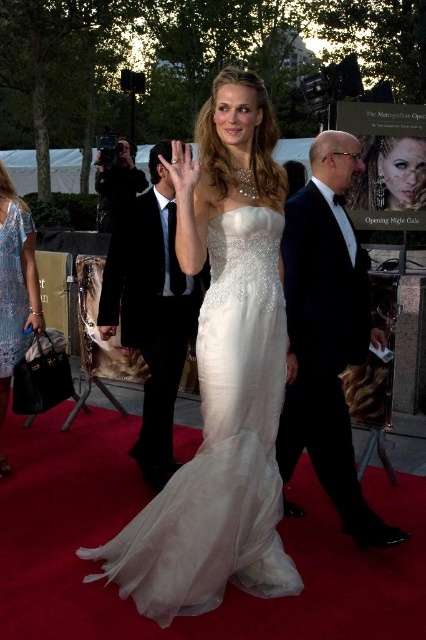
Can you confirm if shiny black suit at center is positioned to the left of shiny blue dress at lower left?

No, shiny black suit at center is not to the left of shiny blue dress at lower left.

This screenshot has height=640, width=426. What do you see at coordinates (152, 310) in the screenshot? I see `shiny black suit at center` at bounding box center [152, 310].

Does point (137, 209) come closer to viewer compared to point (8, 253)?

No, it is behind (8, 253).

Identify the location of shiny black suit at center. The image size is (426, 640). (152, 310).

Does point (181, 484) come closer to viewer compared to point (135, 269)?

Yes, it is in front of point (135, 269).

Who is more forward, (238, 522) or (149, 420)?

Positioned in front is point (238, 522).

At what (x,y) coordinates should I click in order to perform the action: click on satin/sheer white dress at center. Please return your answer as a coordinate pair (x, y). Looking at the image, I should click on (221, 445).

Find the location of a particular element. This screenshot has width=426, height=640. shiny blue dress at lower left is located at coordinates (16, 284).

Based on the photo, how distant is shiny blue dress at lower left from lace fabric dress at left?

A distance of 2.04 inches exists between shiny blue dress at lower left and lace fabric dress at left.

Is point (8, 392) positioned before point (0, 298)?

That is False.

In order to click on shiny blue dress at lower left in this screenshot , I will do `click(16, 284)`.